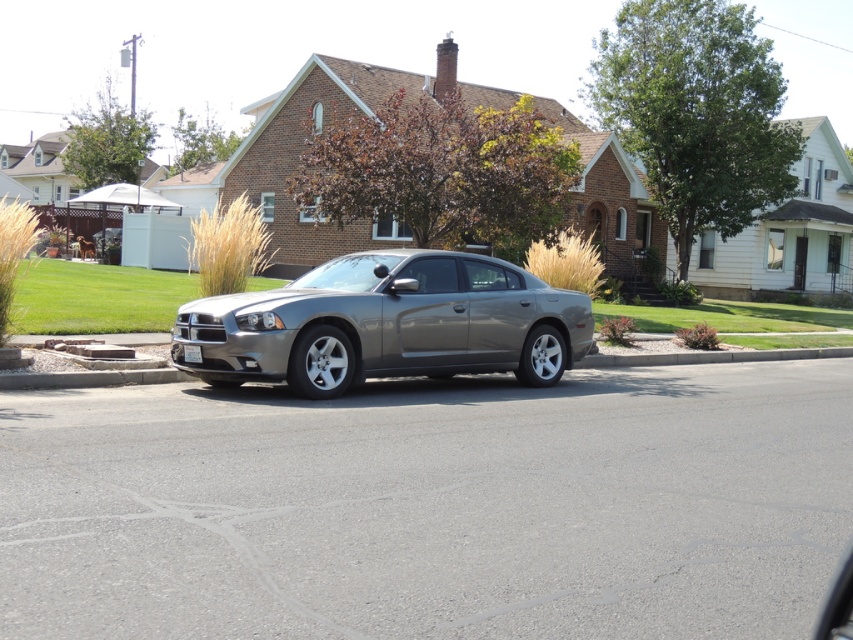
Is point (640, 486) positioned before point (187, 352)?

Yes, it is.

Is gray asphalt driveway at center thinner than white plastic license plate at center?

In fact, gray asphalt driveway at center might be wider than white plastic license plate at center.

The height and width of the screenshot is (640, 853). I want to click on gray asphalt driveway at center, so click(430, 506).

This screenshot has width=853, height=640. I want to click on gray asphalt driveway at center, so click(x=430, y=506).

Is satin metallic sedan at center above white plastic license plate at center?

Yes, satin metallic sedan at center is above white plastic license plate at center.

The width and height of the screenshot is (853, 640). What do you see at coordinates (387, 324) in the screenshot?
I see `satin metallic sedan at center` at bounding box center [387, 324].

At what (x,y) coordinates should I click in order to perform the action: click on satin metallic sedan at center. Please return your answer as a coordinate pair (x, y). This screenshot has height=640, width=853. Looking at the image, I should click on point(387,324).

Can you confirm if gray asphalt driveway at center is thinner than satin metallic sedan at center?

In fact, gray asphalt driveway at center might be wider than satin metallic sedan at center.

Is point (407, 438) positioned before point (527, 314)?

Yes, it is.

Between point (45, 572) and point (422, 269), which one is positioned behind?

The point (422, 269) is behind.

The width and height of the screenshot is (853, 640). I want to click on gray asphalt driveway at center, so click(430, 506).